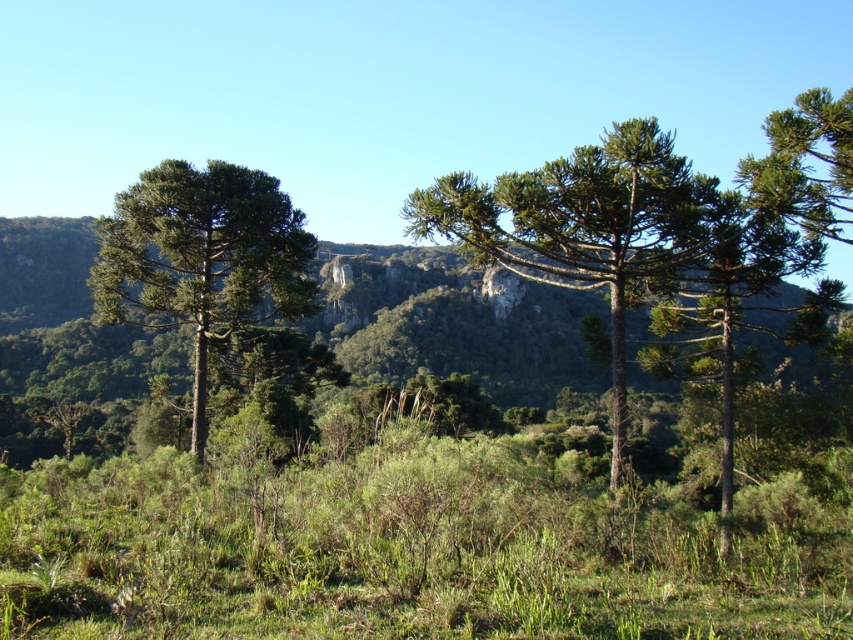
Is the position of green textured pine tree at left more distant than that of green needle-like foliage at center-right?

Yes, it is.

Who is more distant from viewer, [154,250] or [764,228]?

The point [154,250] is behind.

Find the location of a particular element. green textured pine tree at left is located at coordinates (202, 259).

Can you confirm if green textured tree at center is taller than green needle-like foliage at center-right?

Yes.

Locate an element on the screen. green textured tree at center is located at coordinates (589, 227).

Does green textured tree at center have a greater height compared to green textured pine tree at left?

No.

Who is shorter, green textured tree at center or green textured pine tree at left?

With less height is green textured tree at center.

At what (x,y) coordinates should I click in order to perform the action: click on green textured tree at center. Please return your answer as a coordinate pair (x, y). The image size is (853, 640). Looking at the image, I should click on (589, 227).

In order to click on green textured tree at center in this screenshot , I will do `click(589, 227)`.